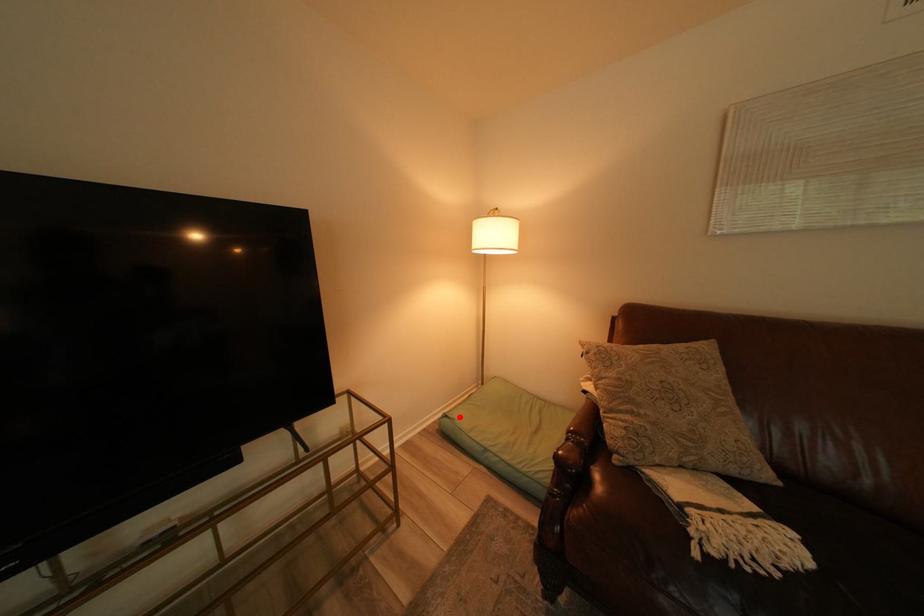
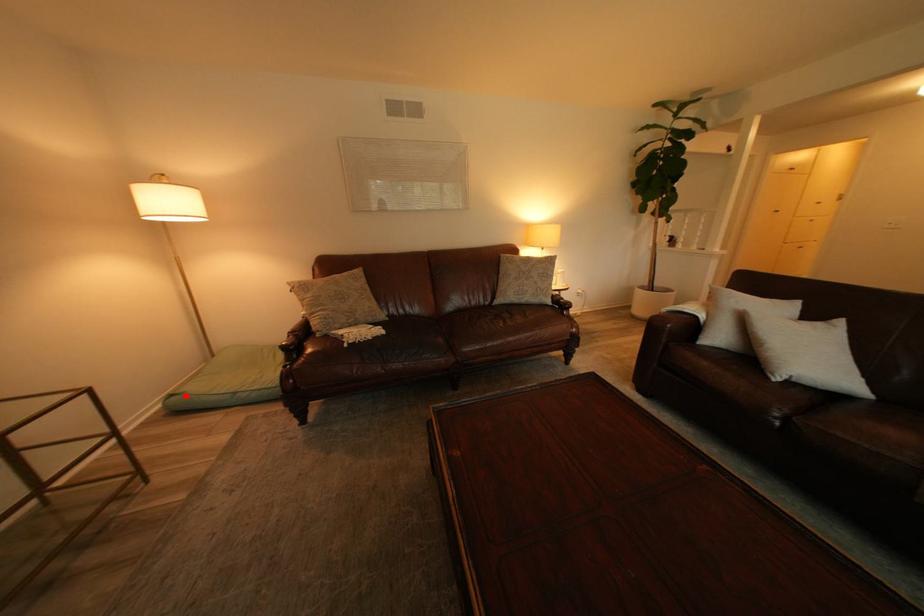
From the picture: I am providing you with two images of the same scene from different viewpoints. A red point is marked on the first image and another point is marked on the second image. Is the marked point in image1 the same physical position as the marked point in image2?

Yes